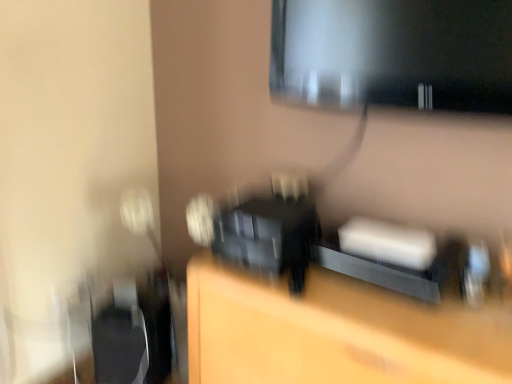
Question: Does point (125, 382) appear closer or farther from the camera than point (437, 360)?

Choices:
 (A) closer
 (B) farther

Answer: (B)

Question: Is black plastic swivel chair at left inside or outside of matte black speaker at center?

Choices:
 (A) inside
 (B) outside

Answer: (B)

Question: Estimate the real-world distances between objects in this image. Which object is farther from the matte black monitor at upper right?

Choices:
 (A) matte black speaker at center
 (B) black plastic swivel chair at left

Answer: (B)

Question: Estimate the real-world distances between objects in this image. Which object is farther from the matte black monitor at upper right?

Choices:
 (A) black plastic swivel chair at left
 (B) matte black speaker at center

Answer: (A)